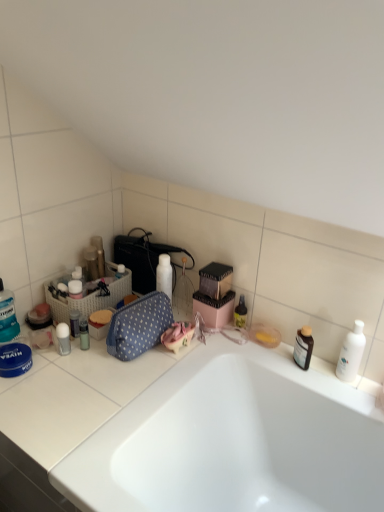
The height and width of the screenshot is (512, 384). In order to click on vacant space to the left of brown glass bottle at right, the 2th toiletry when ordered from right to left in this screenshot , I will do `click(260, 360)`.